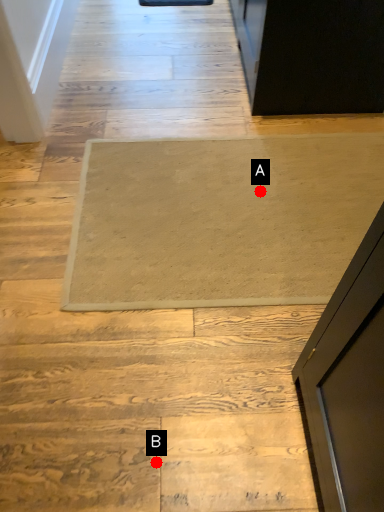
Question: Two points are circled on the image, labeled by A and B beside each circle. Which of the following is the farthest from the observer?

Choices:
 (A) A is further
 (B) B is further

Answer: (A)